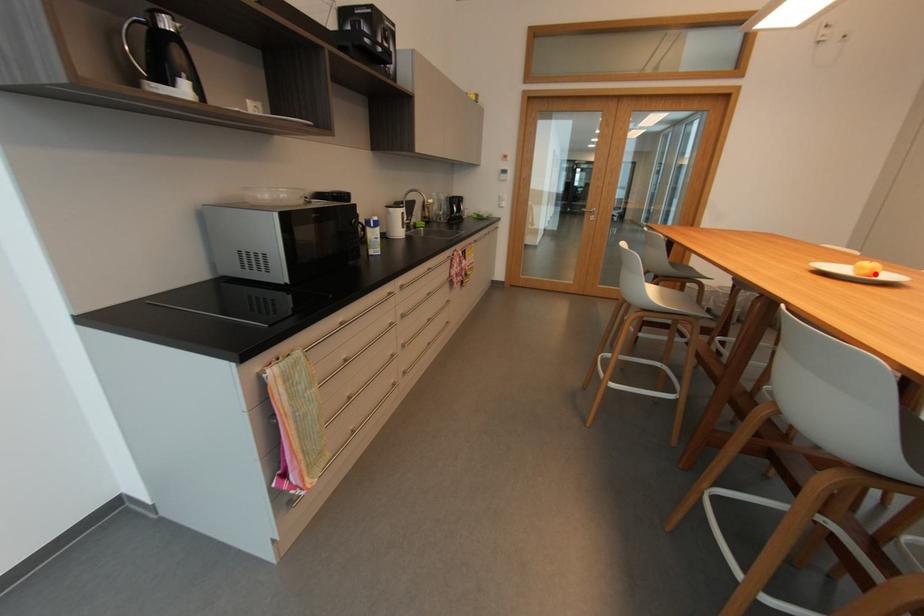
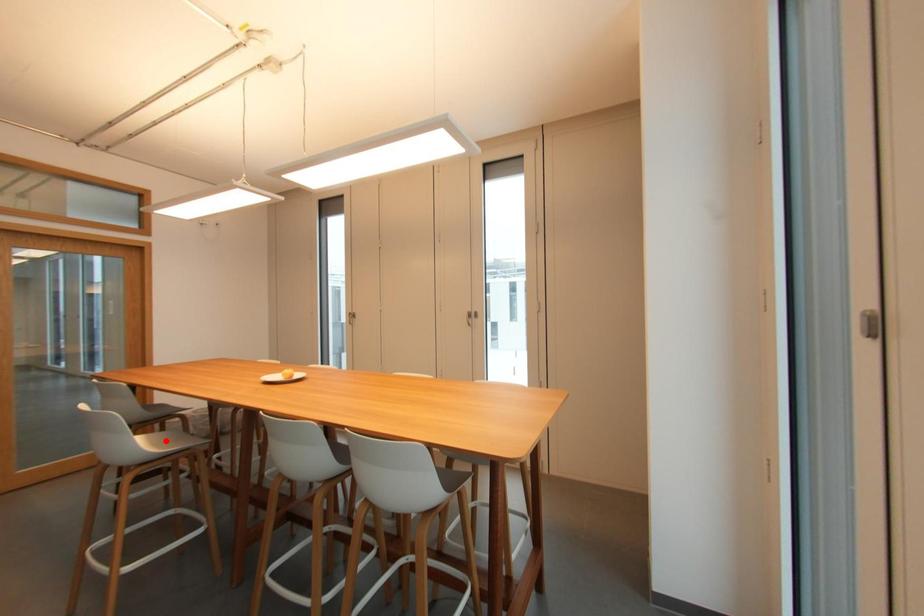
I am providing you with two images of the same scene from different viewpoints. A red point is marked on the first image and another point is marked on the second image. Are the points marked in image1 and image2 representing the same 3D position?

No